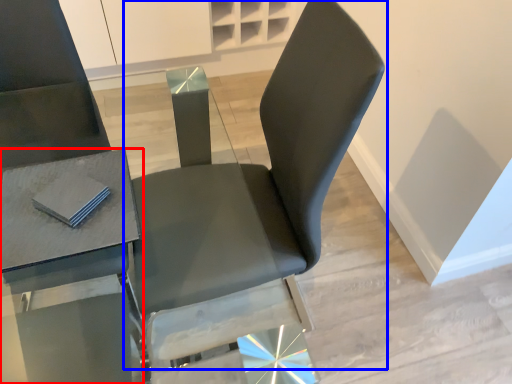
Question: Which point is closer to the camera, table (highlighted by a red box) or chair (highlighted by a blue box)?

Choices:
 (A) table
 (B) chair

Answer: (A)